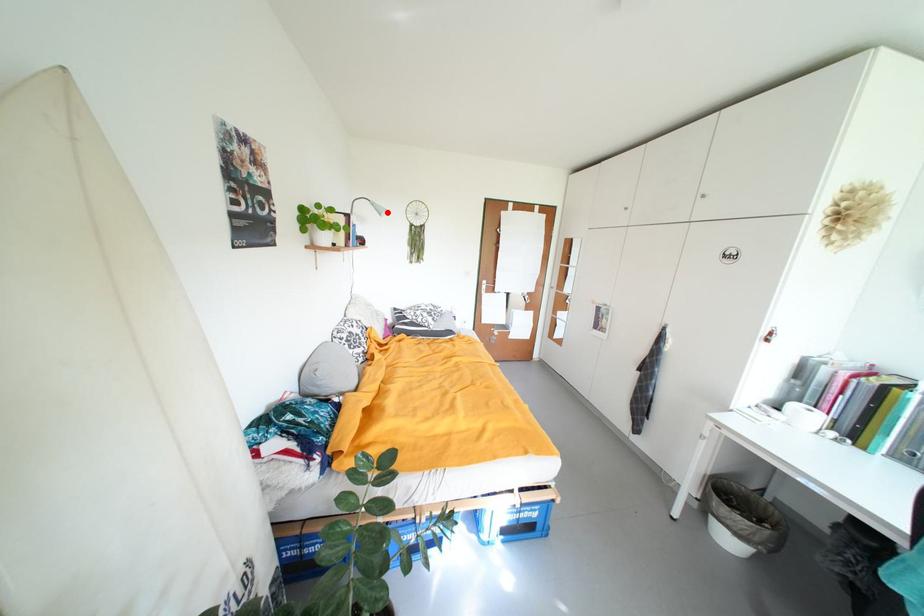
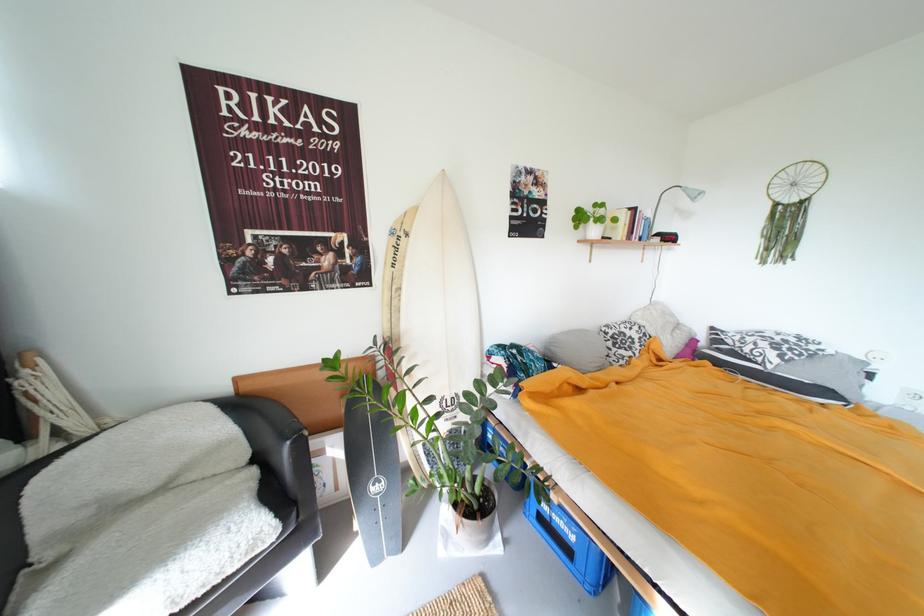
Where in the second image is the point corresponding to the highlighted location from the first image?

(703, 198)